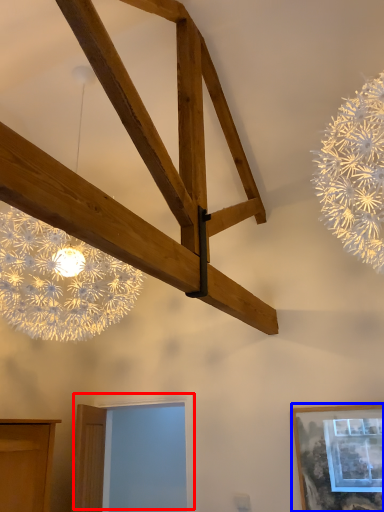
Question: Among these objects, which one is nearest to the camera, window (highlighted by a red box) or picture frame (highlighted by a blue box)?

Choices:
 (A) window
 (B) picture frame

Answer: (B)